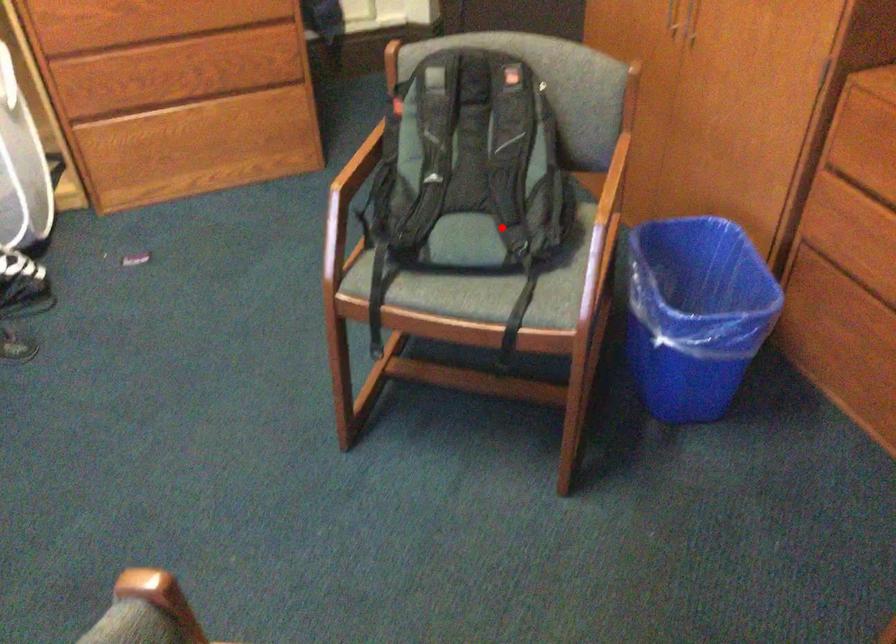
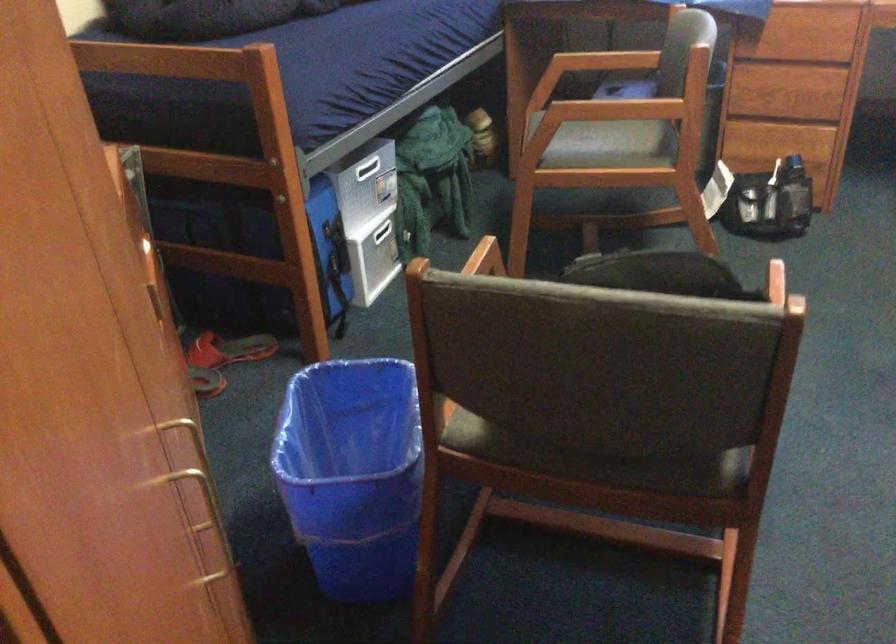
Question: A red point is marked in image1. In image2, is the corresponding 3D point closer to the camera or farther? Reply with the corresponding letter.

Choices:
 (A) The corresponding 3D point is closer.
 (B) The corresponding 3D point is farther.

Answer: (A)